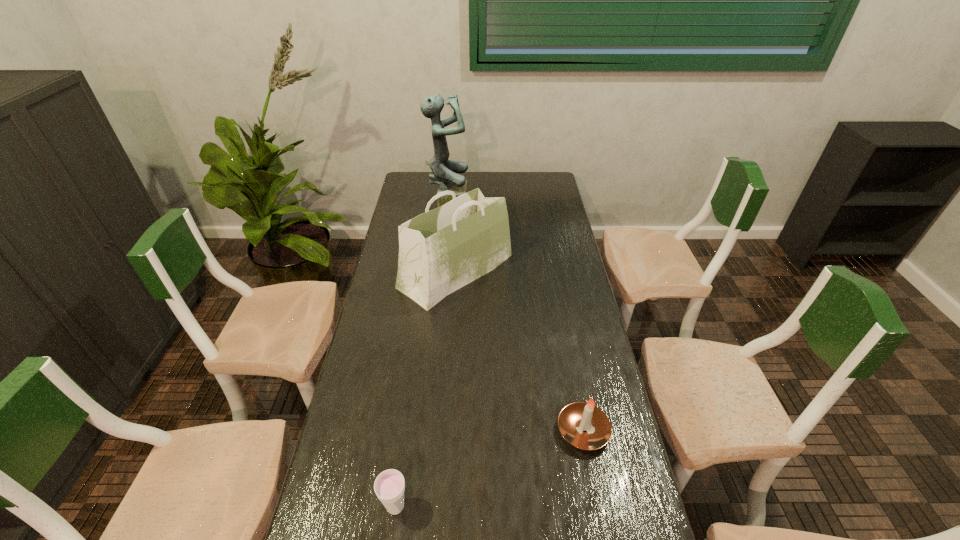
This screenshot has width=960, height=540. Identify the location of the farthest object. (444, 172).

In order to click on sculpture in this screenshot , I will do `click(444, 172)`.

The image size is (960, 540). I want to click on the second tallest object, so click(440, 251).

Image resolution: width=960 pixels, height=540 pixels. Find the location of `grocery bag`. grocery bag is located at coordinates (440, 251).

Where is `the third farthest object`? the third farthest object is located at coordinates (575, 418).

The height and width of the screenshot is (540, 960). In order to click on the rightmost object in this screenshot , I will do `click(575, 418)`.

At what (x,y) coordinates should I click in order to perform the action: click on the nearest object. Please return your answer as a coordinate pair (x, y). Looking at the image, I should click on (389, 486).

Find the location of a particular element. cup is located at coordinates (389, 486).

Where is `vacant space positioned on the face of the tallest object`? vacant space positioned on the face of the tallest object is located at coordinates (479, 204).

Locate an element on the screen. vacant region located on the back of the grocery bag is located at coordinates (461, 197).